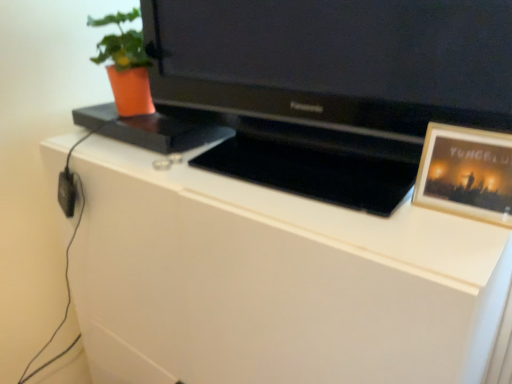
Question: Is black glossy television at center facing away from white matte cabinet at center?

Choices:
 (A) no
 (B) yes

Answer: (A)

Question: Is black glossy television at center wider than white matte cabinet at center?

Choices:
 (A) no
 (B) yes

Answer: (A)

Question: Could you tell me if black glossy television at center is facing white matte cabinet at center?

Choices:
 (A) yes
 (B) no

Answer: (B)

Question: Considering the relative positions of black glossy television at center and white matte cabinet at center in the image provided, is black glossy television at center to the left of white matte cabinet at center from the viewer's perspective?

Choices:
 (A) no
 (B) yes

Answer: (A)

Question: From a real-world perspective, is black glossy television at center physically above white matte cabinet at center?

Choices:
 (A) no
 (B) yes

Answer: (B)

Question: Does point (114, 54) appear closer or farther from the camera than point (217, 294)?

Choices:
 (A) farther
 (B) closer

Answer: (A)

Question: From a real-world perspective, relative to white matte cabinet at center, is orange matte pot at upper left vertically above or below?

Choices:
 (A) above
 (B) below

Answer: (A)

Question: Based on their positions, is orange matte pot at upper left located to the left or right of white matte cabinet at center?

Choices:
 (A) left
 (B) right

Answer: (A)

Question: Considering the positions of orange matte pot at upper left and white matte cabinet at center in the image, is orange matte pot at upper left taller or shorter than white matte cabinet at center?

Choices:
 (A) tall
 (B) short

Answer: (B)

Question: Considering the positions of black glossy television at center and orange matte pot at upper left in the image, is black glossy television at center taller or shorter than orange matte pot at upper left?

Choices:
 (A) short
 (B) tall

Answer: (B)

Question: Is black glossy television at center bigger or smaller than orange matte pot at upper left?

Choices:
 (A) small
 (B) big

Answer: (B)

Question: Is black glossy television at center situated inside orange matte pot at upper left or outside?

Choices:
 (A) outside
 (B) inside

Answer: (A)

Question: In the image, is black glossy television at center on the left side or the right side of orange matte pot at upper left?

Choices:
 (A) left
 (B) right

Answer: (B)

Question: Considering their positions, is black glossy television at center located in front of or behind white matte cabinet at center?

Choices:
 (A) behind
 (B) front

Answer: (B)

Question: Is black glossy television at center wider or thinner than white matte cabinet at center?

Choices:
 (A) thin
 (B) wide

Answer: (A)